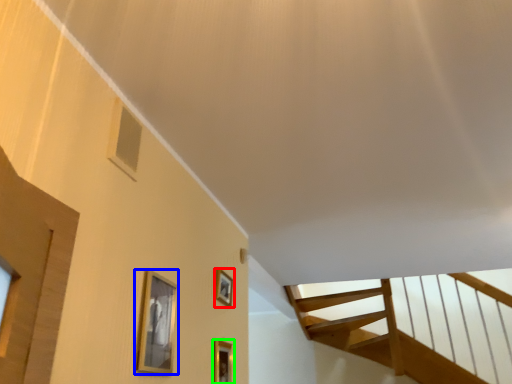
Question: Based on their relative distances, which object is nearer to picture frame (highlighted by a red box)? Choose from picture frame (highlighted by a blue box) and picture frame (highlighted by a green box).

Choices:
 (A) picture frame
 (B) picture frame

Answer: (B)